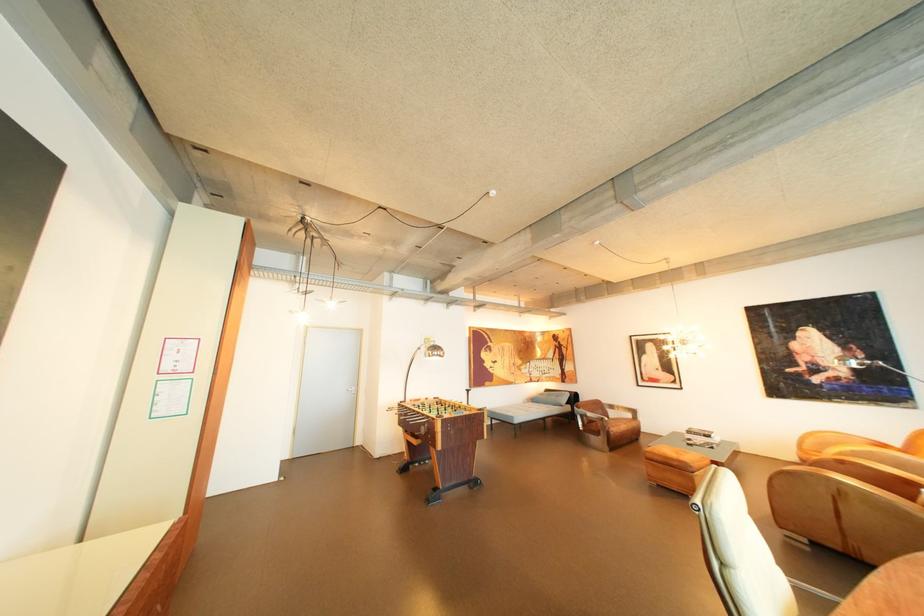
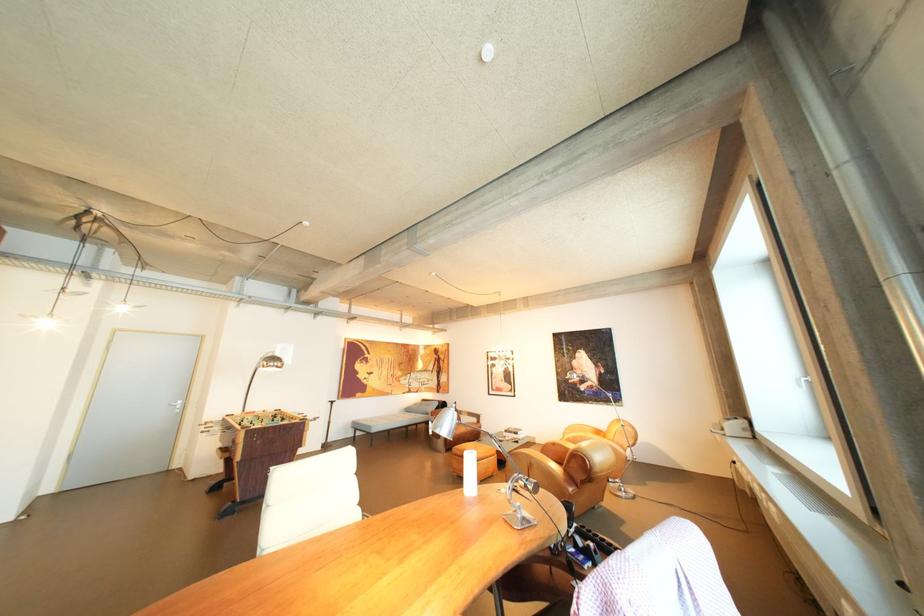
The images are taken continuously from a first-person perspective. In which direction are you moving?

The cameraman walked toward right, backward.